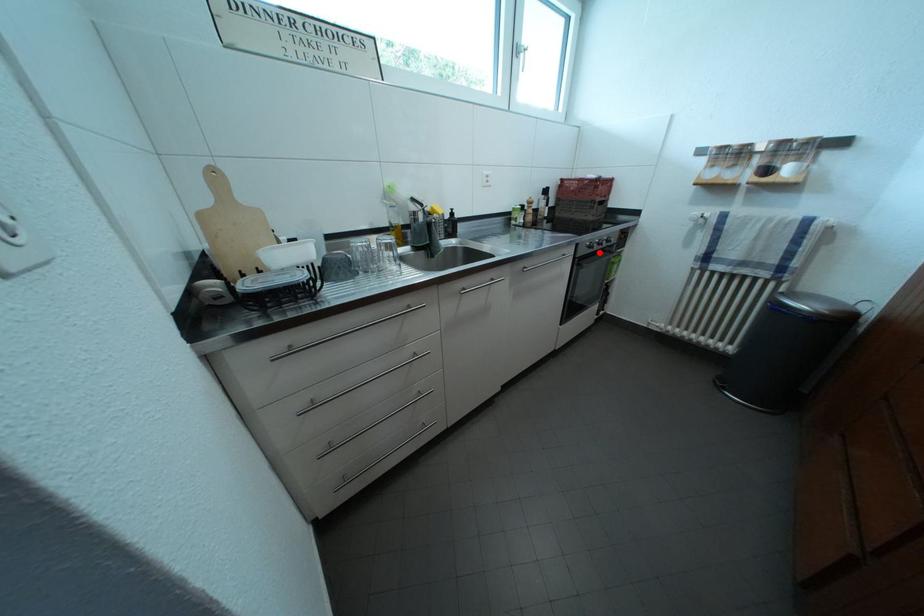
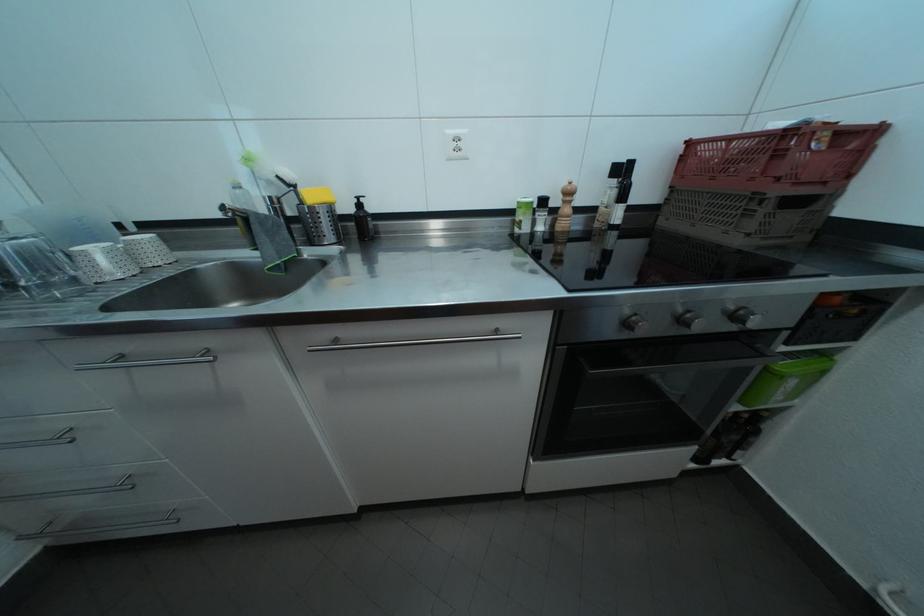
Find the pixel in the second image that matches the highlighted location in the first image.

(638, 330)